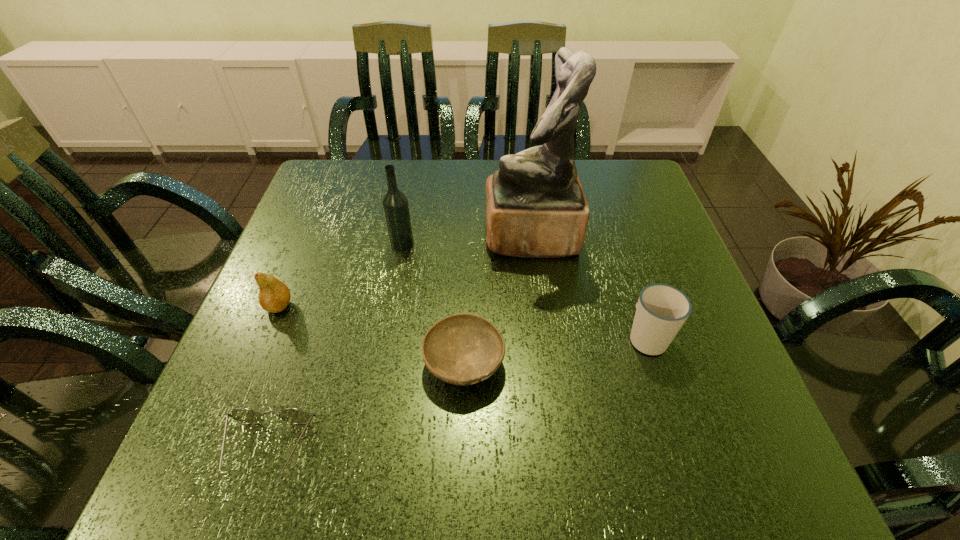
This screenshot has height=540, width=960. In order to click on object present at the near left corner in this screenshot , I will do `click(245, 415)`.

Where is `vacant space at the far edge of the desktop`? The image size is (960, 540). vacant space at the far edge of the desktop is located at coordinates (381, 190).

Where is `vacant space at the near edge of the desktop`? The height and width of the screenshot is (540, 960). vacant space at the near edge of the desktop is located at coordinates (612, 449).

This screenshot has width=960, height=540. What are the coordinates of `free space at the left edge` in the screenshot? It's located at (330, 235).

Locate an element on the screen. This screenshot has height=540, width=960. free space at the right edge is located at coordinates (705, 331).

The height and width of the screenshot is (540, 960). In order to click on vacant space at the far left corner of the desktop in this screenshot , I will do `click(343, 167)`.

The width and height of the screenshot is (960, 540). In order to click on free location at the far right corner in this screenshot , I will do `click(596, 210)`.

Identify the location of vacant region at the near right corner of the desktop. The width and height of the screenshot is (960, 540). (703, 472).

This screenshot has height=540, width=960. What are the coordinates of `free space between the bowl and the cup` in the screenshot? It's located at (556, 350).

Where is `vacant region between the vodka and the rightmost object`? The width and height of the screenshot is (960, 540). vacant region between the vodka and the rightmost object is located at coordinates (524, 291).